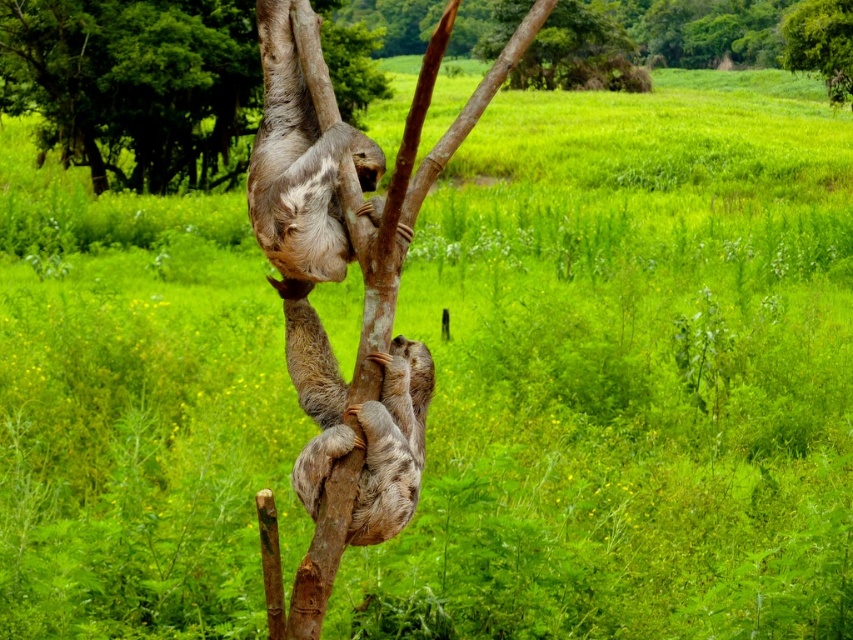
You are a bird flying over the scene. You see the point marked at coordinates (366, 435). Which object is this point located on?

The point marked at coordinates (366, 435) is located on the brown fuzzy sloth at center.

You are a bird looking for a place to perch. You see the brown rough tree trunk at upper center and the green leafy tree at upper right. Which one would you choose if you want to land on the bigger tree?

The brown rough tree trunk at upper center is larger in size than the green leafy tree at upper right, so you should choose the brown rough tree trunk at upper center to land on.

You are a bird flying over the scene. You see the brown fuzzy sloth at center and the green leafy tree at upper right. Which one appears bigger from your perspective?

The brown fuzzy sloth at center appears bigger than the green leafy tree at upper right because it has a larger size compared to the green leafy tree at upper right.